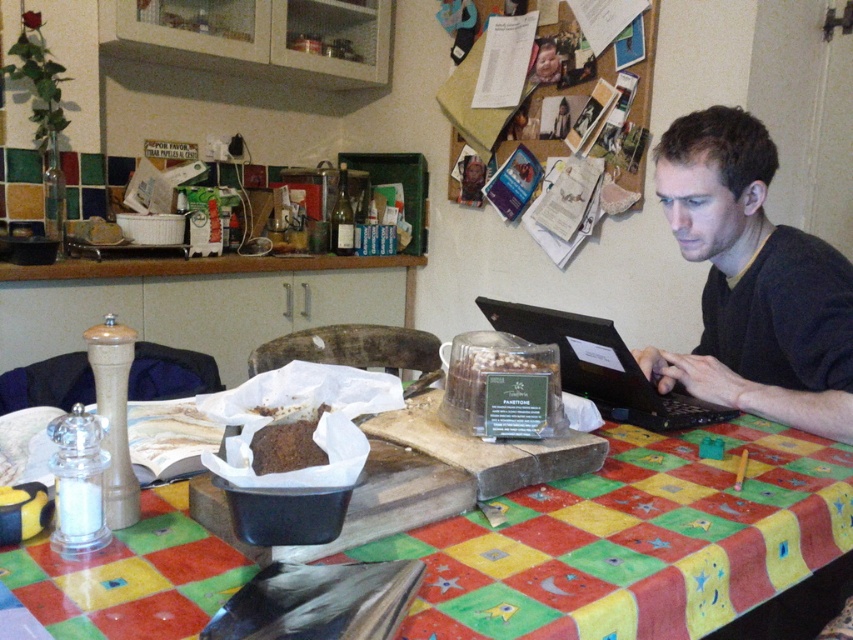
You are organizing a dinner party and need to decide where to place a large centerpiece. The multicolored fabric tablecloth at center and the dark gray sweater at right are both on the table. Which object has enough space to accommodate the centerpiece?

The multicolored fabric tablecloth at center has a greater width than the dark gray sweater at right, so it can accommodate the large centerpiece.

You are a delivery person who needs to place a small package on the table in the kitchen. The package must be placed at the exact coordinates where the black plastic laptop at center is located. However, the laptop is currently in use. Can you move the laptop to another spot on the table to make space for the package?

The black plastic laptop at center is located at coordinates point (601, 368). Since the laptop is in use, you cannot move it. Therefore, you cannot place the package at that exact location without disturbing the user.